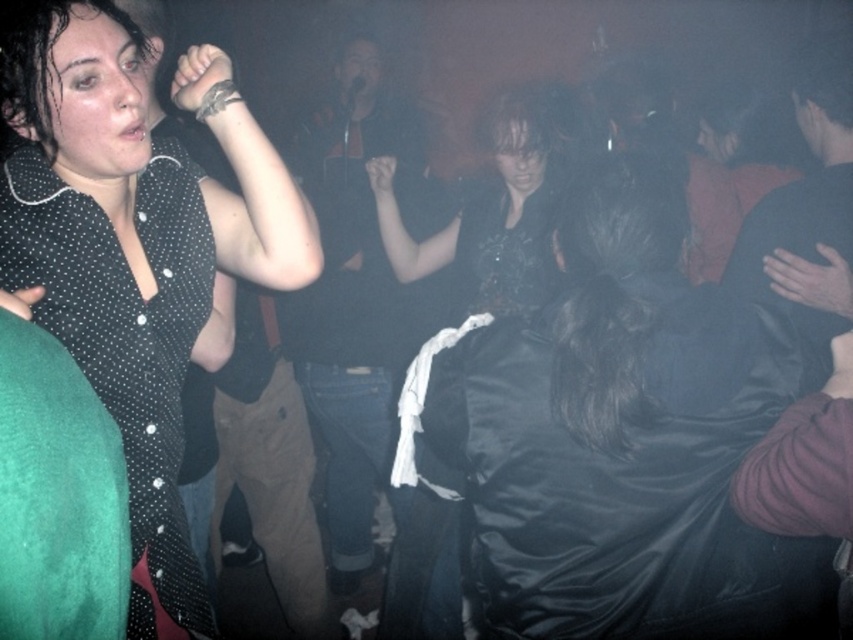
Question: Does shiny black dress at center come in front of black dotted shirt at upper left?

Choices:
 (A) yes
 (B) no

Answer: (B)

Question: Can you confirm if shiny black dress at center is positioned to the right of black dotted shirt at upper left?

Choices:
 (A) no
 (B) yes

Answer: (B)

Question: From the image, what is the correct spatial relationship of shiny black dress at center in relation to black dotted shirt at upper left?

Choices:
 (A) left
 (B) right

Answer: (B)